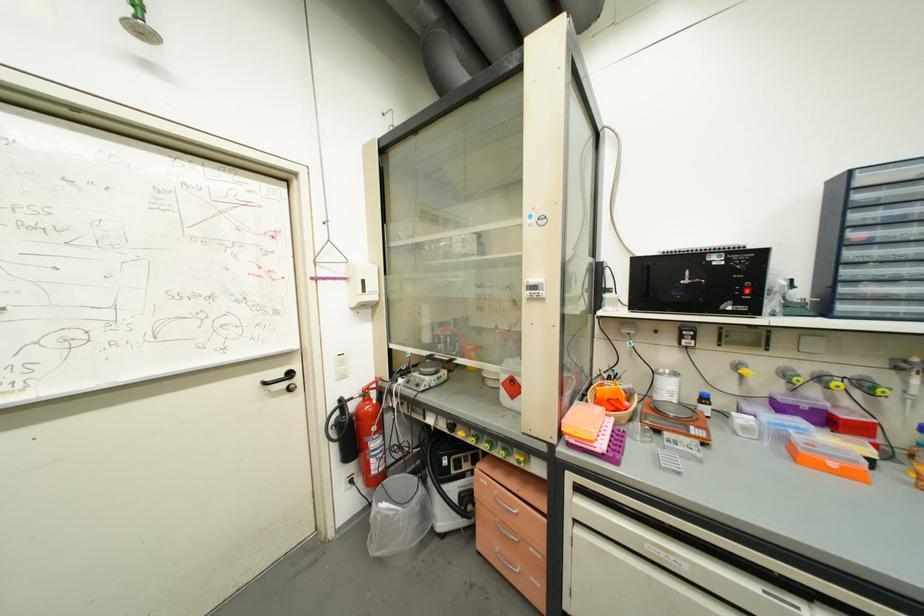
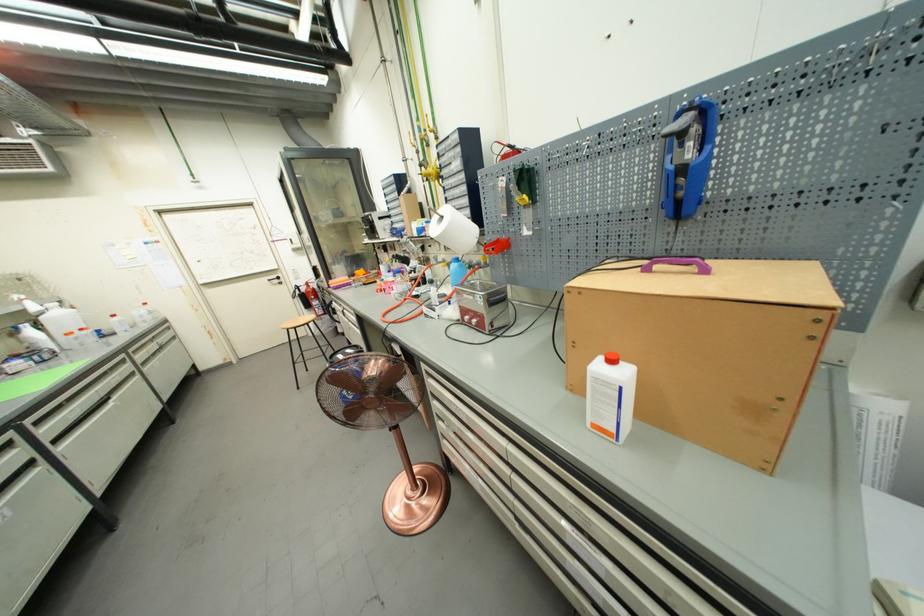
In the second image, find the point that corresponds to point 271,386 in the first image.

(274, 282)